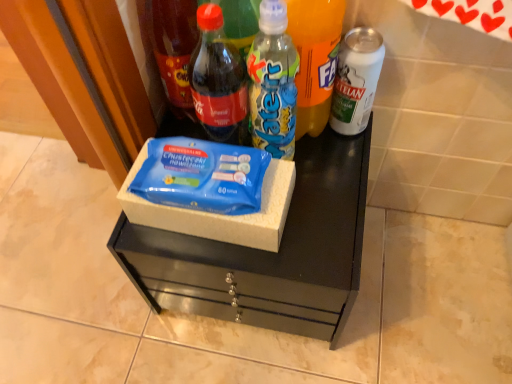
The height and width of the screenshot is (384, 512). I want to click on vacant area that lies in front of white matte can at right, marked as the 1th bottle in a right-to-left arrangement, so click(x=330, y=199).